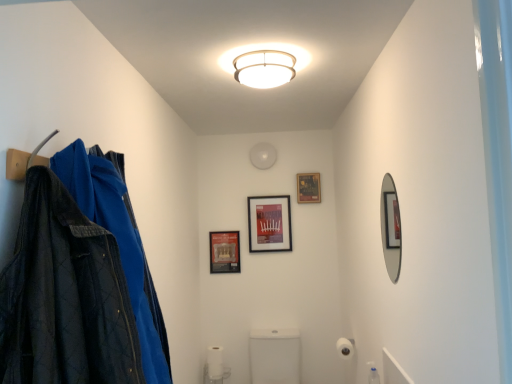
From the picture: What is the approximate width of white matte toilet paper at lower right, arranged as the second toilet paper when viewed from the back?

white matte toilet paper at lower right, arranged as the second toilet paper when viewed from the back, is 4.77 inches wide.

The width and height of the screenshot is (512, 384). I want to click on matte black picture frame at center, arranged as the first picture frame when viewed from the left, so click(x=224, y=252).

What do you see at coordinates (269, 223) in the screenshot?
I see `matte black picture frame at center, the 2th picture frame positioned from the right` at bounding box center [269, 223].

Describe the element at coordinates (215, 363) in the screenshot. I see `white matte toilet paper at lower center, the 1th toilet paper when ordered from left to right` at that location.

At what (x,y) coordinates should I click in order to perform the action: click on silver-framed mirror at right. Please return your answer as a coordinate pair (x, y). This screenshot has width=512, height=384. Looking at the image, I should click on (391, 228).

From the picture: Could you tell me if matte black picture frame at upper center, acting as the 1th picture frame starting from the right, is turned towards matte black picture frame at center, arranged as the first picture frame when viewed from the left?

No.

Considering the sizes of objects matte black picture frame at upper center, acting as the 1th picture frame starting from the right, and matte black picture frame at center, the 3th picture frame when ordered from right to left, in the image provided, who is wider, matte black picture frame at upper center, acting as the 1th picture frame starting from the right, or matte black picture frame at center, the 3th picture frame when ordered from right to left,?

With larger width is matte black picture frame at upper center, acting as the 1th picture frame starting from the right.

From a real-world perspective, starting from the matte black picture frame at center, the 3th picture frame when ordered from right to left, which picture frame is the 2nd one vertically above it? Please provide its 2D coordinates.

[(308, 188)]

Is matte black picture frame at center, arranged as the first picture frame when viewed from the left, located within matte black picture frame at upper center, acting as the 1th picture frame starting from the right?

No.

Visually, is white matte toilet paper at lower center, the 2th toilet paper from the top, positioned to the left or to the right of silver-framed mirror at right?

white matte toilet paper at lower center, the 2th toilet paper from the top, is positioned on silver-framed mirror at right's left side.

Could you tell me if white matte toilet paper at lower center, the 1th toilet paper when ordered from left to right, is turned towards silver-framed mirror at right?

No, white matte toilet paper at lower center, the 1th toilet paper when ordered from left to right, does not turn towards silver-framed mirror at right.

Is white matte toilet paper at lower center, the 2th toilet paper from the top, touching silver-framed mirror at right?

No, white matte toilet paper at lower center, the 2th toilet paper from the top, is not beside silver-framed mirror at right.

Considering the relative positions of white matte toilet paper at lower center, the 2th toilet paper from the top, and silver-framed mirror at right in the image provided, is white matte toilet paper at lower center, the 2th toilet paper from the top, behind silver-framed mirror at right?

Yes, it is behind silver-framed mirror at right.

Looking at this image, between white matte toilet paper at lower right, acting as the 1th toilet paper starting from the front, and matte black picture frame at center, arranged as the first picture frame when viewed from the left, which one has smaller size?

Smaller between the two is matte black picture frame at center, arranged as the first picture frame when viewed from the left.

From the image's perspective, which object appears higher, white matte toilet paper at lower right, arranged as the first toilet paper when viewed from the top, or matte black picture frame at center, arranged as the first picture frame when viewed from the left?

From the image's view, matte black picture frame at center, arranged as the first picture frame when viewed from the left, is above.

Is the surface of white matte toilet paper at lower right, arranged as the first toilet paper when viewed from the top, in direct contact with matte black picture frame at center, arranged as the first picture frame when viewed from the left?

white matte toilet paper at lower right, arranged as the first toilet paper when viewed from the top, and matte black picture frame at center, arranged as the first picture frame when viewed from the left, are clearly separated.

From a real-world perspective, is white matte toilet paper at lower right, acting as the second toilet paper starting from the bottom, above or below matte black picture frame at center, arranged as the first picture frame when viewed from the left?

white matte toilet paper at lower right, acting as the second toilet paper starting from the bottom, is situated lower than matte black picture frame at center, arranged as the first picture frame when viewed from the left, in the real world.

Who is smaller, silver-framed mirror at right or matte black picture frame at upper center, acting as the 1th picture frame starting from the right?

matte black picture frame at upper center, acting as the 1th picture frame starting from the right, is smaller.

Is silver-framed mirror at right wider than matte black picture frame at upper center, placed as the 3th picture frame when sorted from left to right?

In fact, silver-framed mirror at right might be narrower than matte black picture frame at upper center, placed as the 3th picture frame when sorted from left to right.

Measure the distance between silver-framed mirror at right and matte black picture frame at upper center, placed as the 3th picture frame when sorted from left to right.

silver-framed mirror at right and matte black picture frame at upper center, placed as the 3th picture frame when sorted from left to right, are 1.50 meters apart from each other.

Who is taller, silver-framed mirror at right or matte black picture frame at upper center, acting as the 1th picture frame starting from the right?

Standing taller between the two is silver-framed mirror at right.

Based on the photo, from a real-world perspective, between white matte toilet paper at lower center, which is the second toilet paper in right-to-left order, and matte black picture frame at upper center, acting as the 1th picture frame starting from the right, who is vertically lower?

white matte toilet paper at lower center, which is the second toilet paper in right-to-left order, from a real-world perspective.

Is white matte toilet paper at lower center, the 2th toilet paper from the top, oriented away from matte black picture frame at upper center, placed as the 3th picture frame when sorted from left to right?

No.

From the matte black picture frame at upper center, placed as the 3th picture frame when sorted from left to right, count 1st toilet papers forward and point to it. Please provide its 2D coordinates.

[(215, 363)]

What's the angular difference between white matte toilet paper at lower center, the 2th toilet paper from the top, and matte black picture frame at upper center, acting as the 1th picture frame starting from the right,'s facing directions?

0.644 degrees separate the facing orientations of white matte toilet paper at lower center, the 2th toilet paper from the top, and matte black picture frame at upper center, acting as the 1th picture frame starting from the right.

Does matte black picture frame at center, arranged as the first picture frame when viewed from the left, have a smaller size compared to white matte toilet paper at lower right, arranged as the first toilet paper when viewed from the top?

Correct, matte black picture frame at center, arranged as the first picture frame when viewed from the left, occupies less space than white matte toilet paper at lower right, arranged as the first toilet paper when viewed from the top.

Is matte black picture frame at center, the 3th picture frame when ordered from right to left, outside of white matte toilet paper at lower right, acting as the second toilet paper starting from the bottom?

That's correct, matte black picture frame at center, the 3th picture frame when ordered from right to left, is outside of white matte toilet paper at lower right, acting as the second toilet paper starting from the bottom.

From the picture: Which object is positioned more to the right, matte black picture frame at center, the 3th picture frame when ordered from right to left, or white matte toilet paper at lower right, acting as the second toilet paper starting from the bottom?

white matte toilet paper at lower right, acting as the second toilet paper starting from the bottom, is more to the right.

Who is taller, matte black picture frame at center, the 3th picture frame when ordered from right to left, or white matte toilet paper at lower right, arranged as the first toilet paper when viewed from the top?

Standing taller between the two is matte black picture frame at center, the 3th picture frame when ordered from right to left.

From the image's perspective, is white matte toilet paper at lower right, arranged as the first toilet paper when viewed from the top, on silver-framed mirror at right?

No, from the image's perspective, white matte toilet paper at lower right, arranged as the first toilet paper when viewed from the top, is not on top of silver-framed mirror at right.

Considering the relative sizes of white matte toilet paper at lower right, acting as the second toilet paper starting from the bottom, and silver-framed mirror at right in the image provided, is white matte toilet paper at lower right, acting as the second toilet paper starting from the bottom, shorter than silver-framed mirror at right?

Yes.

Would you say white matte toilet paper at lower right, arranged as the first toilet paper when viewed from the top, is inside or outside silver-framed mirror at right?

white matte toilet paper at lower right, arranged as the first toilet paper when viewed from the top, is spatially situated outside silver-framed mirror at right.

Is white matte toilet paper at lower right, acting as the 1th toilet paper starting from the front, wider than silver-framed mirror at right?

Yes, white matte toilet paper at lower right, acting as the 1th toilet paper starting from the front, is wider than silver-framed mirror at right.

Where is `picture frame that is the 2nd object to the right of the matte black picture frame at center, the 3th picture frame when ordered from right to left, starting at the anchor`? picture frame that is the 2nd object to the right of the matte black picture frame at center, the 3th picture frame when ordered from right to left, starting at the anchor is located at coordinates (308, 188).

At what (x,y) coordinates should I click in order to perform the action: click on mirror located above the white matte toilet paper at lower center, the 1th toilet paper from the back (from the image's perspective). Please return your answer as a coordinate pair (x, y). Looking at the image, I should click on pyautogui.click(x=391, y=228).

Estimate the real-world distances between objects in this image. Which object is closer to white glossy toilet at center, matte black picture frame at upper center, acting as the 1th picture frame starting from the right, or white matte toilet paper at lower center, which is the second toilet paper in right-to-left order?

The object closer to white glossy toilet at center is white matte toilet paper at lower center, which is the second toilet paper in right-to-left order.

Based on their spatial positions, is white matte toilet paper at lower center, which is counted as the 1th toilet paper, starting from the bottom, or white matte toilet paper at lower right, arranged as the first toilet paper when viewed from the top, closer to matte black picture frame at center, the 2th picture frame positioned from the right?

Among the two, white matte toilet paper at lower right, arranged as the first toilet paper when viewed from the top, is located nearer to matte black picture frame at center, the 2th picture frame positioned from the right.

When comparing their distances from white glossy toilet at center, does silver-framed mirror at right or matte black picture frame at center, arranged as the first picture frame when viewed from the left, seem further?

silver-framed mirror at right.

Based on their spatial positions, is white matte toilet paper at lower right, arranged as the second toilet paper when viewed from the back, or silver-framed mirror at right further from white matte toilet paper at lower center, the 2th toilet paper from the top?

silver-framed mirror at right is further to white matte toilet paper at lower center, the 2th toilet paper from the top.

From the image, which object appears to be farther from matte black picture frame at upper center, placed as the 3th picture frame when sorted from left to right, matte black picture frame at center, the 3th picture frame when ordered from right to left, or silver-framed mirror at right?

silver-framed mirror at right lies further to matte black picture frame at upper center, placed as the 3th picture frame when sorted from left to right, than the other object.

Looking at the image, which one is located closer to white matte toilet paper at lower right, which appears as the 1th toilet paper when viewed from the right, matte black picture frame at center, the 3th picture frame when ordered from right to left, or silver-framed mirror at right?

matte black picture frame at center, the 3th picture frame when ordered from right to left, is closer to white matte toilet paper at lower right, which appears as the 1th toilet paper when viewed from the right.

From the picture: Looking at the image, which one is located further to matte black picture frame at center, arranged as the first picture frame when viewed from the left, white matte toilet paper at lower center, which is the second toilet paper in right-to-left order, or white glossy toilet at center?

The object further to matte black picture frame at center, arranged as the first picture frame when viewed from the left, is white matte toilet paper at lower center, which is the second toilet paper in right-to-left order.

Estimate the real-world distances between objects in this image. Which object is further from white glossy toilet at center, white matte toilet paper at lower right, the second toilet paper from the left, or white matte toilet paper at lower center, acting as the 2th toilet paper starting from the front?

white matte toilet paper at lower right, the second toilet paper from the left, is further to white glossy toilet at center.

Identify the location of toilet bowl positioned between silver-framed mirror at right and matte black picture frame at center, placed as the second picture frame when sorted from left to right, from near to far. This screenshot has height=384, width=512. (275, 356).

This screenshot has width=512, height=384. What are the coordinates of `toilet bowl positioned between silver-framed mirror at right and white matte toilet paper at lower center, the 2th toilet paper from the top, from near to far` in the screenshot? It's located at (275, 356).

The width and height of the screenshot is (512, 384). Find the location of `picture frame situated between matte black picture frame at center, the 3th picture frame when ordered from right to left, and matte black picture frame at upper center, acting as the 1th picture frame starting from the right, from left to right`. picture frame situated between matte black picture frame at center, the 3th picture frame when ordered from right to left, and matte black picture frame at upper center, acting as the 1th picture frame starting from the right, from left to right is located at coordinates (269, 223).

At what (x,y) coordinates should I click in order to perform the action: click on toilet bowl between matte black picture frame at upper center, acting as the 1th picture frame starting from the right, and white matte toilet paper at lower center, the 2th toilet paper from the top, in the vertical direction. Please return your answer as a coordinate pair (x, y). Looking at the image, I should click on (275, 356).